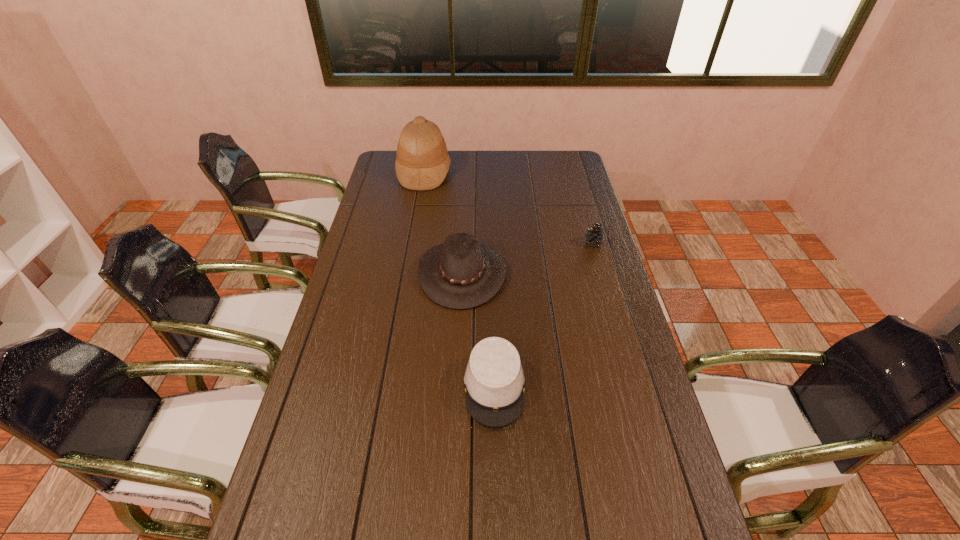
What are the coordinates of `hat that is the closest to the rightmost object` in the screenshot? It's located at (462, 273).

Locate which hat ranks in proximity to the rightmost object. Please provide its 2D coordinates. Your answer should be formatted as a tuple, i.e. [(x, y)], where the tuple contains the x and y coordinates of a point satisfying the conditions above.

[(462, 273)]

You are a GUI agent. You are given a task and a screenshot of the screen. Output one action in this format:
    pyautogui.click(x=<x>, y=<y>)
    Task: Click on the free region that satisfies the following two spatial constraints: 1. on the front-facing side of the tallest hat; 2. on the back side of the rightmost object
    
    Given the screenshot: What is the action you would take?
    pyautogui.click(x=412, y=243)

The image size is (960, 540). Find the location of `vacant point that satisfies the following two spatial constraints: 1. on the back side of the rightmost object; 2. on the front-facing side of the tallest object`. vacant point that satisfies the following two spatial constraints: 1. on the back side of the rightmost object; 2. on the front-facing side of the tallest object is located at coordinates (573, 172).

Identify the location of vacant area in the image that satisfies the following two spatial constraints: 1. on the front side of the pinecone; 2. on the front-facing side of the third shortest object. (602, 273).